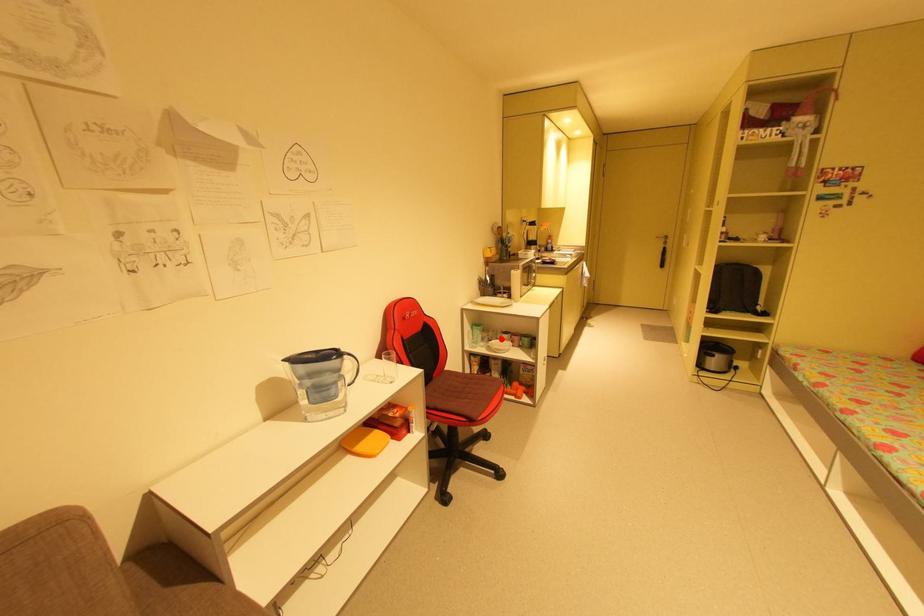
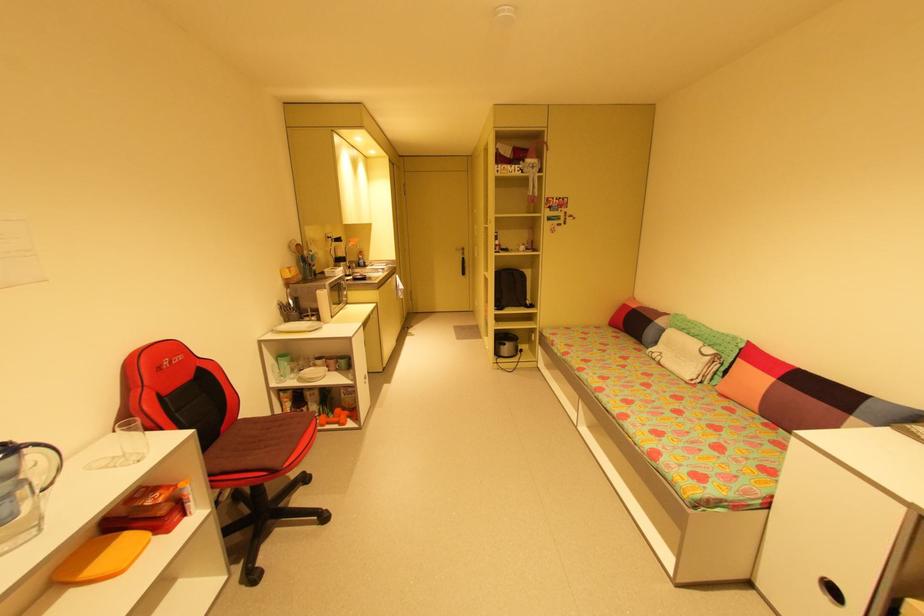
Locate, in the second image, the point that corresponds to the highlighted location in the first image.

(313, 367)